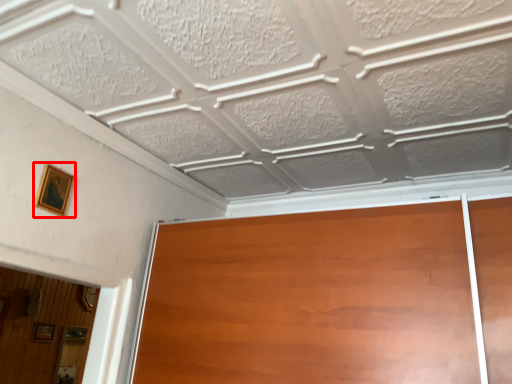
Question: Where is picture frame (annotated by the red box) located in relation to picture frame in the image?

Choices:
 (A) right
 (B) left

Answer: (A)